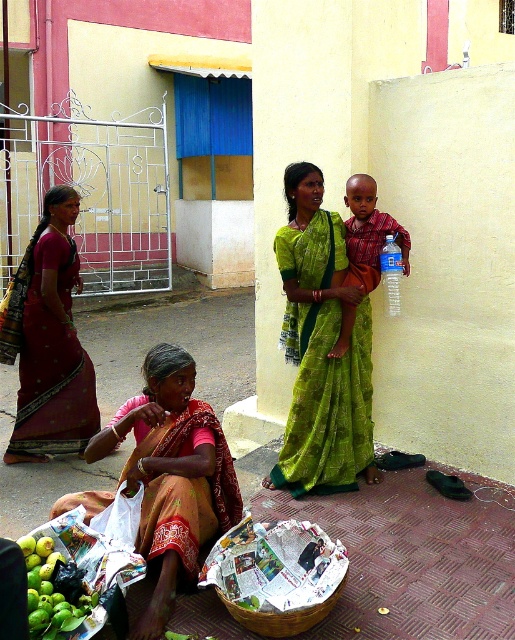
Measure the distance between point (298, 477) and camera.

A distance of 4.13 meters exists between point (298, 477) and camera.

Is green silk saree at center bigger than matte red shirt at center?

Correct, green silk saree at center is larger in size than matte red shirt at center.

Image resolution: width=515 pixels, height=640 pixels. What do you see at coordinates (320, 349) in the screenshot?
I see `green silk saree at center` at bounding box center [320, 349].

Image resolution: width=515 pixels, height=640 pixels. What are the coordinates of `green silk saree at center` in the screenshot? It's located at (320, 349).

From the picture: Who is taller, green silk saree at center or matte orange saree at lower left?

green silk saree at center

The image size is (515, 640). Find the location of `green silk saree at center`. green silk saree at center is located at coordinates (320, 349).

What do you see at coordinates (320, 349) in the screenshot? The height and width of the screenshot is (640, 515). I see `green silk saree at center` at bounding box center [320, 349].

Where is `green silk saree at center`? The image size is (515, 640). green silk saree at center is located at coordinates (320, 349).

Between pink tile pavement at lower center and lime green fruit at lower left, which one is positioned lower?

Positioned lower is pink tile pavement at lower center.

Can you confirm if pink tile pavement at lower center is bigger than lime green fruit at lower left?

No.

Locate an element on the screen. The height and width of the screenshot is (640, 515). pink tile pavement at lower center is located at coordinates (407, 554).